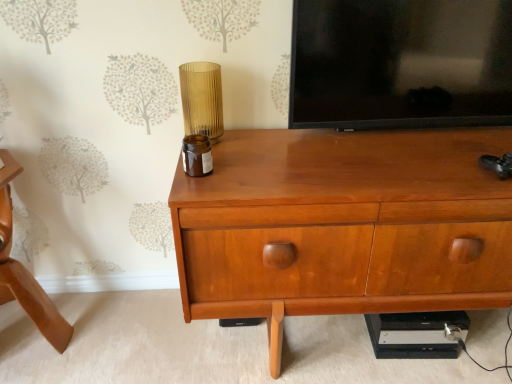
Question: Is translucent amber glass at center positioned in front of wooden chest of drawers at center?

Choices:
 (A) no
 (B) yes

Answer: (A)

Question: From a real-world perspective, does translucent amber glass at center stand above wooden chest of drawers at center?

Choices:
 (A) no
 (B) yes

Answer: (B)

Question: Is translucent amber glass at center smaller than wooden chest of drawers at center?

Choices:
 (A) yes
 (B) no

Answer: (A)

Question: From a real-world perspective, is translucent amber glass at center physically below wooden chest of drawers at center?

Choices:
 (A) no
 (B) yes

Answer: (A)

Question: Could you tell me if translucent amber glass at center is facing wooden chest of drawers at center?

Choices:
 (A) no
 (B) yes

Answer: (A)

Question: Considering the relative positions of translucent amber glass at center and wooden chest of drawers at center in the image provided, is translucent amber glass at center to the left of wooden chest of drawers at center from the viewer's perspective?

Choices:
 (A) yes
 (B) no

Answer: (A)

Question: Is wooden chair at lower left further to camera compared to black glossy tv at upper center?

Choices:
 (A) yes
 (B) no

Answer: (B)

Question: Does wooden chair at lower left contain black glossy tv at upper center?

Choices:
 (A) no
 (B) yes

Answer: (A)

Question: Is wooden chair at lower left closer to the viewer compared to black glossy tv at upper center?

Choices:
 (A) no
 (B) yes

Answer: (B)

Question: Is wooden chair at lower left turned away from black glossy tv at upper center?

Choices:
 (A) yes
 (B) no

Answer: (B)

Question: From the image's perspective, is wooden chair at lower left under black glossy tv at upper center?

Choices:
 (A) yes
 (B) no

Answer: (A)

Question: Is wooden chair at lower left aimed at black glossy tv at upper center?

Choices:
 (A) yes
 (B) no

Answer: (B)

Question: From a real-world perspective, is translucent amber glass at center physically above wooden chair at lower left?

Choices:
 (A) yes
 (B) no

Answer: (A)